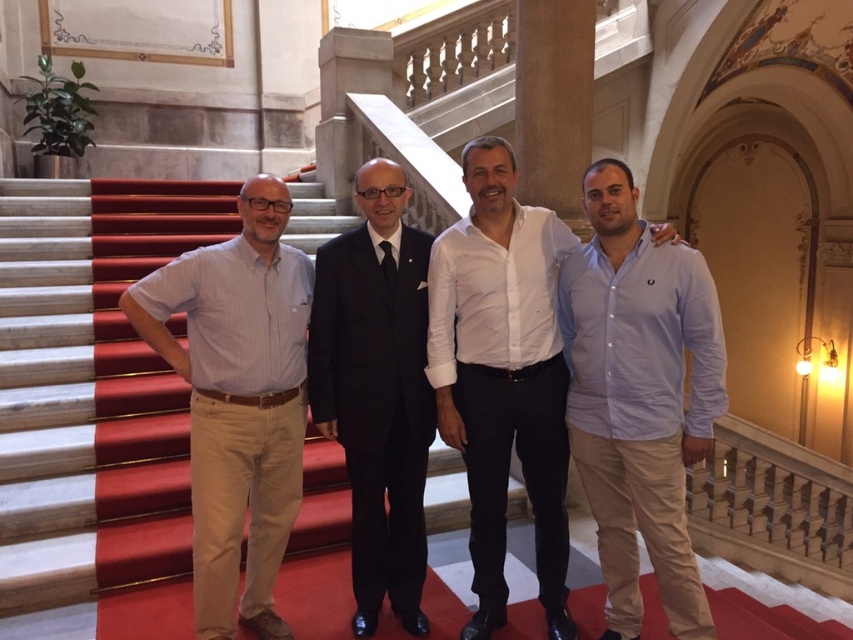
Can you confirm if light blue striped shirt at left is taller than white cotton shirt at center?

No, light blue striped shirt at left is not taller than white cotton shirt at center.

Between light blue striped shirt at left and white cotton shirt at center, which one has more height?

white cotton shirt at center is taller.

This screenshot has width=853, height=640. I want to click on light blue striped shirt at left, so click(x=238, y=401).

Is point (613, 618) positioned before point (538, 515)?

That is True.

At what (x,y) coordinates should I click in order to perform the action: click on light blue button-down shirt at center. Please return your answer as a coordinate pair (x, y). The height and width of the screenshot is (640, 853). Looking at the image, I should click on (639, 397).

Can you confirm if light blue striped shirt at left is shorter than black suit at center?

Yes, light blue striped shirt at left is shorter than black suit at center.

Which is more to the right, light blue striped shirt at left or black suit at center?

From the viewer's perspective, black suit at center appears more on the right side.

Is point (209, 474) closer to camera compared to point (364, 497)?

Yes, point (209, 474) is in front of point (364, 497).

You are a GUI agent. You are given a task and a screenshot of the screen. Output one action in this format:
    pyautogui.click(x=<x>, y=<y>)
    Task: Click on the light blue striped shirt at left
    The image size is (853, 640).
    Given the screenshot: What is the action you would take?
    pyautogui.click(x=238, y=401)